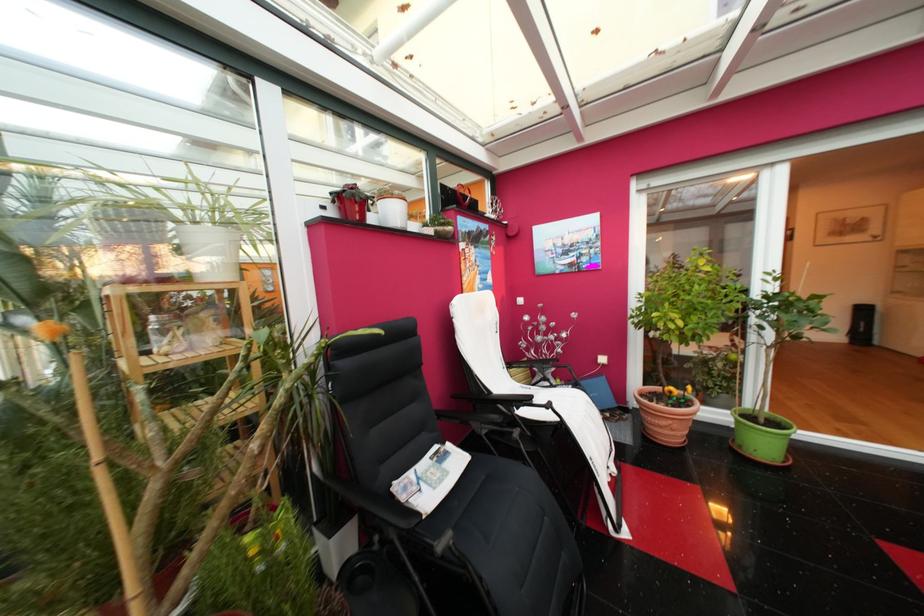
Identify the location of black chair sitting surface. (422, 488).